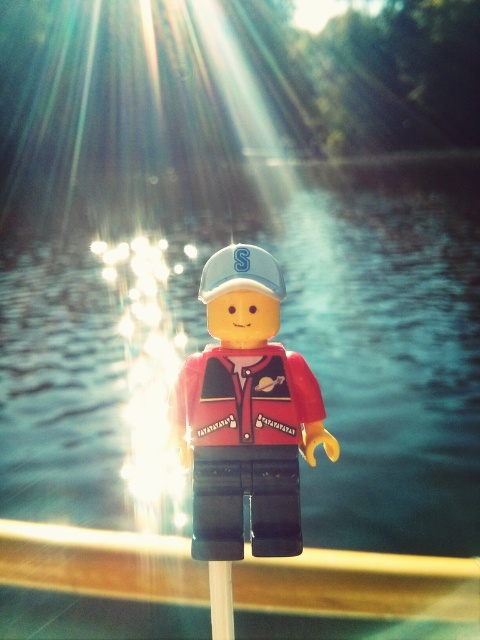
Which is below, blue water at center or white plastic pole at center?

white plastic pole at center is below.

Who is taller, blue water at center or white plastic pole at center?

With more height is blue water at center.

This screenshot has height=640, width=480. Describe the element at coordinates (370, 333) in the screenshot. I see `blue water at center` at that location.

Find the location of a particular element. The image size is (480, 640). blue water at center is located at coordinates coord(370,333).

Who is positioned more to the right, blue water at center or matte red plastic minifigure at center?

blue water at center is more to the right.

Does blue water at center have a lesser width compared to matte red plastic minifigure at center?

In fact, blue water at center might be wider than matte red plastic minifigure at center.

Identify the location of blue water at center. (370, 333).

Is matte red plastic minifigure at center bigger than white plastic pole at center?

Yes, matte red plastic minifigure at center is bigger than white plastic pole at center.

This screenshot has height=640, width=480. What do you see at coordinates (247, 412) in the screenshot? I see `matte red plastic minifigure at center` at bounding box center [247, 412].

What are the coordinates of `matte red plastic minifigure at center` in the screenshot? It's located at click(247, 412).